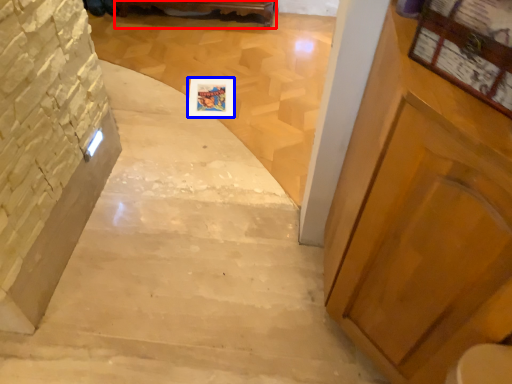
Question: Which of the following is the farthest to the observer, furniture (highlighted by a red box) or picture frame (highlighted by a blue box)?

Choices:
 (A) furniture
 (B) picture frame

Answer: (A)